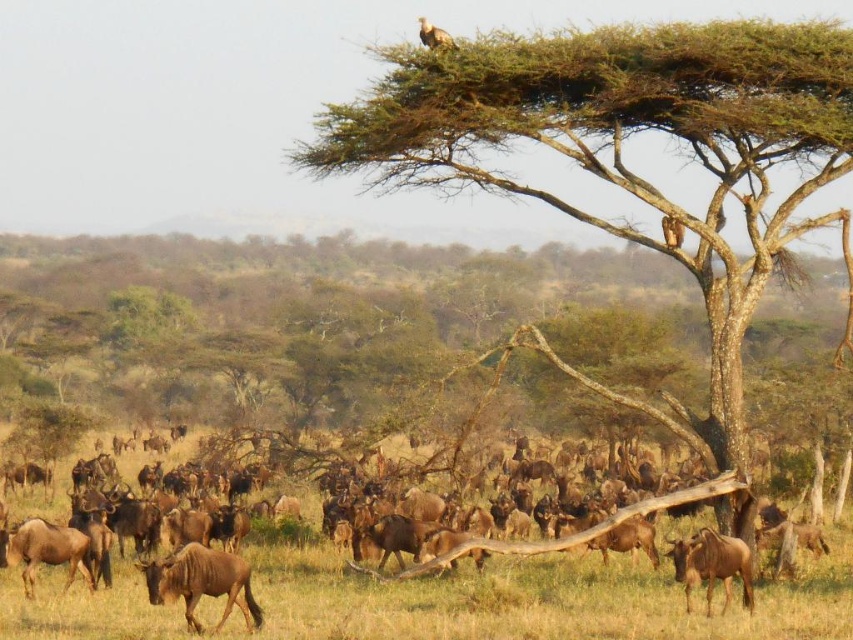
Question: Can you confirm if brown dry grass at center is positioned below brown matte/glossy wildebeest at lower right?

Choices:
 (A) yes
 (B) no

Answer: (A)

Question: Which point is closer to the camera taking this photo?

Choices:
 (A) (245, 564)
 (B) (444, 40)

Answer: (A)

Question: Does brown textured tree at upper center appear on the left side of brown textured bird at upper center?

Choices:
 (A) yes
 (B) no

Answer: (B)

Question: Which point appears farthest from the camera in this image?

Choices:
 (A) (431, 38)
 (B) (851, 145)
 (C) (726, 593)

Answer: (A)

Question: Based on their relative distances, which object is farther from the brown matte/glossy wildebeest at lower left?

Choices:
 (A) brown matte/glossy wildebeest at lower right
 (B) brown dry grass at center

Answer: (A)

Question: Is brown dry grass at center smaller than brown matte/glossy wildebeest at lower right?

Choices:
 (A) yes
 (B) no

Answer: (B)